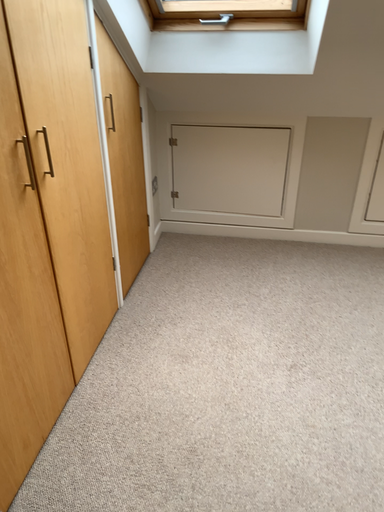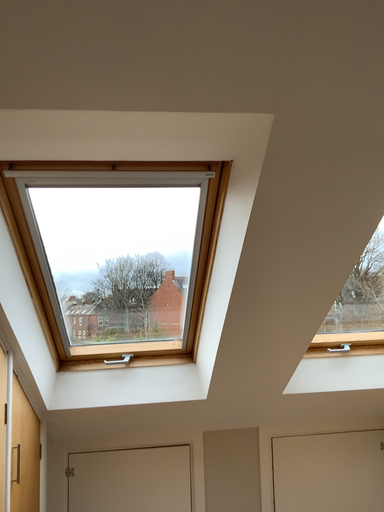
Question: Which way did the camera rotate in the video?

Choices:
 (A) rotated upward
 (B) rotated downward

Answer: (A)